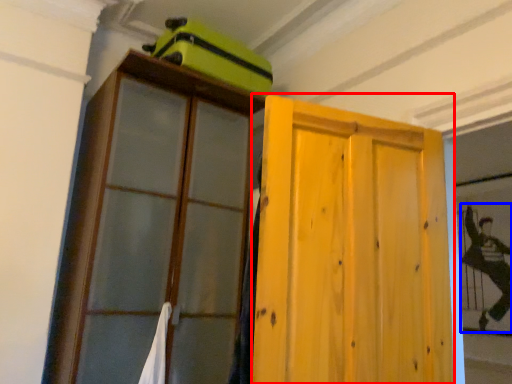
Question: Which object appears farthest to the camera in this image, door (highlighted by a red box) or couple (highlighted by a blue box)?

Choices:
 (A) door
 (B) couple

Answer: (B)